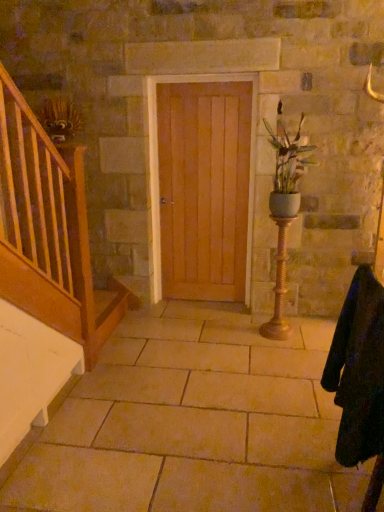
Measure the distance between point (289, 332) and camera.

11.34 feet.

Locate an element on the screen. matte white vase at center right is located at coordinates (288, 170).

The image size is (384, 512). Identify the location of beige stone floor at center. (194, 424).

Considering the relative sizes of beige stone floor at center and gold textured candle holder at center right in the image provided, is beige stone floor at center smaller than gold textured candle holder at center right?

Actually, beige stone floor at center might be larger than gold textured candle holder at center right.

Between point (352, 501) and point (261, 328), which one is positioned behind?

Point (261, 328)

Is gold textured candle holder at center right at the back of beige stone floor at center?

No, beige stone floor at center is not facing the opposite direction of gold textured candle holder at center right.

Can you tell me how much beige stone floor at center and gold textured candle holder at center right differ in facing direction?

There is a 178-degree angle between the facing directions of beige stone floor at center and gold textured candle holder at center right.

Does matte white vase at center right have a greater height compared to beige stone floor at center?

Correct, matte white vase at center right is much taller as beige stone floor at center.

Can you see matte white vase at center right touching beige stone floor at center?

There is a gap between matte white vase at center right and beige stone floor at center.

How far apart are matte white vase at center right and beige stone floor at center?

matte white vase at center right and beige stone floor at center are 1.48 meters apart from each other.

Identify the location of houseplant on the right side of beige stone floor at center. This screenshot has height=512, width=384. (288, 170).

From the image's perspective, between gold textured candle holder at center right and light brown wood door at center, which one is located above?

light brown wood door at center.

Does gold textured candle holder at center right appear on the left side of light brown wood door at center?

No.

This screenshot has width=384, height=512. Find the location of `door above the gold textured candle holder at center right (from a real-world perspective)`. door above the gold textured candle holder at center right (from a real-world perspective) is located at coordinates (158, 166).

From a real-world perspective, which object stands above the other?

light brown wood door at center, from a real-world perspective.

Is black woolen robe at lower right surrounding light brown wood door at center?

No, light brown wood door at center is not surrounded by black woolen robe at lower right.

From the picture: Is black woolen robe at lower right looking in the opposite direction of light brown wood door at center?

That's not correct — black woolen robe at lower right is not looking away from light brown wood door at center.

Is point (361, 389) closer or farther from the camera than point (155, 283)?

Point (361, 389) appears to be closer to the viewer than point (155, 283).

Would you say matte white vase at center right is to the left or to the right of black woolen robe at lower right in the picture?

Based on their positions, matte white vase at center right is located to the left of black woolen robe at lower right.

Between matte white vase at center right and black woolen robe at lower right, which one has larger size?

black woolen robe at lower right.

Is light brown wood door at center completely or partially outside of black woolen robe at lower right?

Indeed, light brown wood door at center is completely outside black woolen robe at lower right.

From a real-world perspective, is light brown wood door at center positioned over black woolen robe at lower right based on gravity?

Correct, in the physical world, light brown wood door at center is higher than black woolen robe at lower right.

Is light brown wood door at center directly adjacent to black woolen robe at lower right?

No, light brown wood door at center is not beside black woolen robe at lower right.

Is light brown wood door at center at the right side of black woolen robe at lower right?

Incorrect, light brown wood door at center is not on the right side of black woolen robe at lower right.

Is matte white vase at center right not near light brown wood door at center?

No, matte white vase at center right is not far from light brown wood door at center.

You are a GUI agent. You are given a task and a screenshot of the screen. Output one action in this format:
    pyautogui.click(x=<x>, y=<y>)
    Task: Click on the houseplant above the light brown wood door at center (from the image's perspective)
    The height and width of the screenshot is (512, 384).
    Given the screenshot: What is the action you would take?
    pyautogui.click(x=288, y=170)

From the image's perspective, which one is positioned lower, matte white vase at center right or light brown wood door at center?

light brown wood door at center.

Visually, is matte white vase at center right positioned to the left or to the right of light brown wood door at center?

matte white vase at center right is positioned on light brown wood door at center's right side.

This screenshot has width=384, height=512. Find the location of `candle holder on the right of the beige stone floor at center`. candle holder on the right of the beige stone floor at center is located at coordinates (279, 285).

The width and height of the screenshot is (384, 512). In order to click on houseplant behind the beige stone floor at center in this screenshot , I will do `click(288, 170)`.

Estimate the real-world distances between objects in this image. Which object is further from matte white vase at center right, light brown wood door at center or beige stone floor at center?

beige stone floor at center is positioned further to the anchor matte white vase at center right.

Which object lies further to the anchor point gold textured candle holder at center right, matte white vase at center right or light brown wood door at center?

The object further to gold textured candle holder at center right is light brown wood door at center.

Considering their positions, is gold textured candle holder at center right positioned closer to black woolen robe at lower right than beige stone floor at center?

Among the two, beige stone floor at center is located nearer to black woolen robe at lower right.

From the picture: Estimate the real-world distances between objects in this image. Which object is closer to light brown wood door at center, beige stone floor at center or matte white vase at center right?

Among the two, matte white vase at center right is located nearer to light brown wood door at center.

Estimate the real-world distances between objects in this image. Which object is further from beige stone floor at center, matte white vase at center right or light brown wood door at center?

matte white vase at center right is positioned further to the anchor beige stone floor at center.

From the picture: Considering their positions, is black woolen robe at lower right positioned closer to gold textured candle holder at center right than matte white vase at center right?

Among the two, matte white vase at center right is located nearer to gold textured candle holder at center right.

In the scene shown: Based on their spatial positions, is light brown wood door at center or matte white vase at center right closer to gold textured candle holder at center right?

The object closer to gold textured candle holder at center right is matte white vase at center right.

Looking at the image, which one is located further to light brown wood door at center, gold textured candle holder at center right or black woolen robe at lower right?

The object further to light brown wood door at center is black woolen robe at lower right.

Where is `houseplant between black woolen robe at lower right and light brown wood door at center from front to back`? The height and width of the screenshot is (512, 384). houseplant between black woolen robe at lower right and light brown wood door at center from front to back is located at coordinates pyautogui.click(x=288, y=170).

Locate an element on the screen. houseplant between beige stone floor at center and light brown wood door at center in the front-back direction is located at coordinates (288, 170).

At what (x,y) coordinates should I click in order to perform the action: click on candle holder located between black woolen robe at lower right and light brown wood door at center in the depth direction. Please return your answer as a coordinate pair (x, y). The height and width of the screenshot is (512, 384). Looking at the image, I should click on (279, 285).

Where is `door between matte white vase at center right and gold textured candle holder at center right in the vertical direction`? door between matte white vase at center right and gold textured candle holder at center right in the vertical direction is located at coordinates (158, 166).